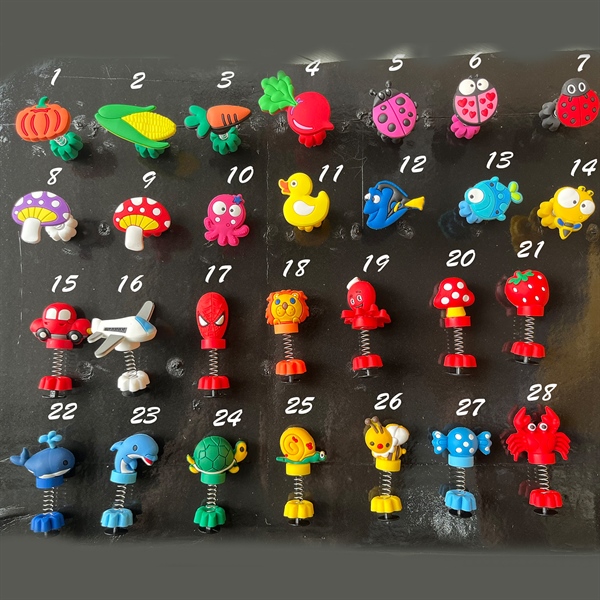
Locate an element on the screen. The image size is (600, 600). fifth column of toys is located at coordinates (381, 451), (354, 315), (389, 210), (394, 118).